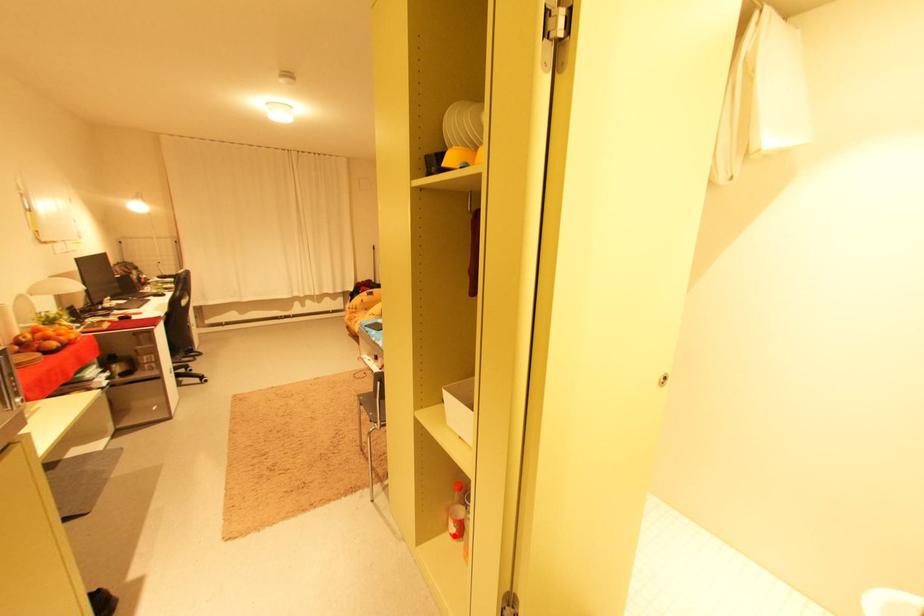
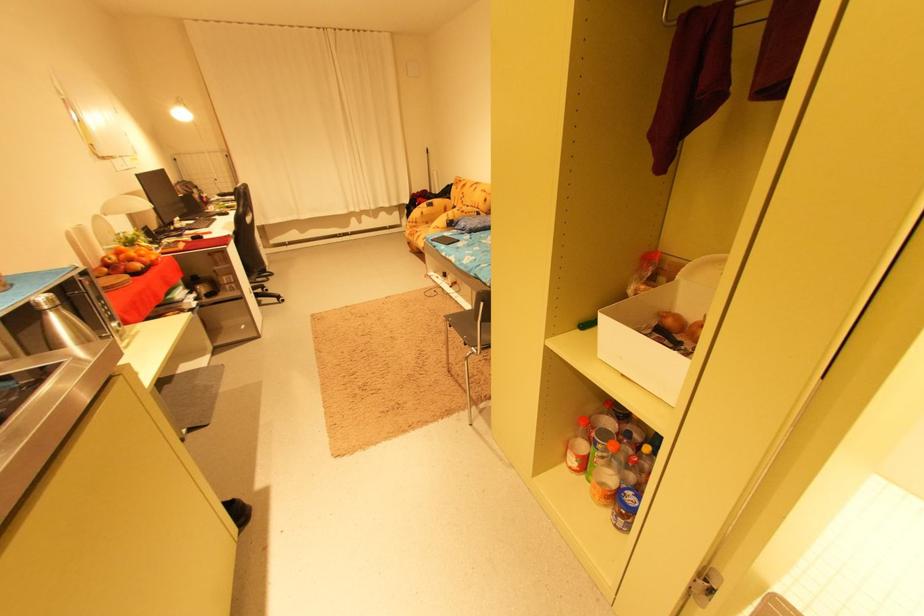
Question: I am providing you with two images of the same scene from different viewpoints. Image1 has a red point marked. In image2, the corresponding 3D location appears at what relative position? Reply with the corresponding letter.

Choices:
 (A) Closer
 (B) Farther

Answer: (A)